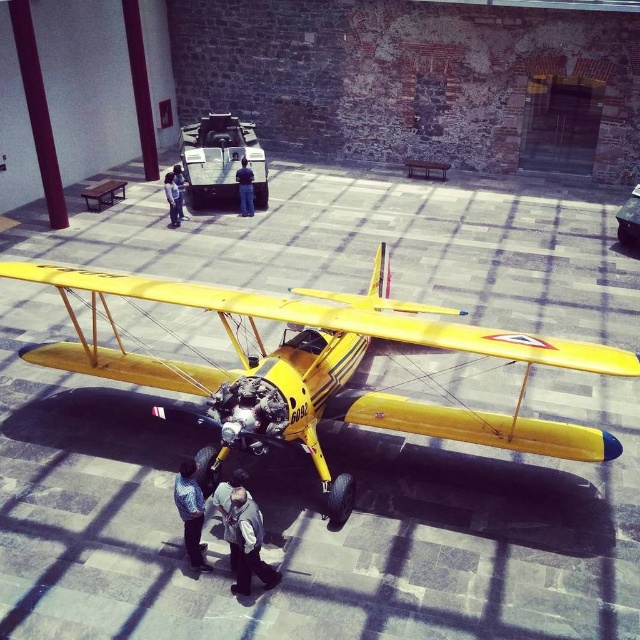
You are at an event where you see two jackets hanging on a rack in front of you. The jackets are the light gray fabric jacket at center and the black leather jacket at center. Which jacket is positioned lower on the rack?

The light gray fabric jacket at center is positioned below the black leather jacket at center, so it is lower on the rack.

You are standing in the scene and want to place a small decorative item on the light gray fabric jacket at center. Given that the jacket is positioned at coordinates point 0.798, 0.358, can you confirm the exact location to place the item?

The light gray fabric jacket at center is located at point (228, 509), so placing the item at those coordinates would be accurate.

You are a tailor measuring two pairs of pants in the image. The blue denim pants at center and the light blue jeans at center. Which pair has a longer inseam?

The light blue jeans at center are longer than the blue denim pants at center, so the light blue jeans at center has a longer inseam.